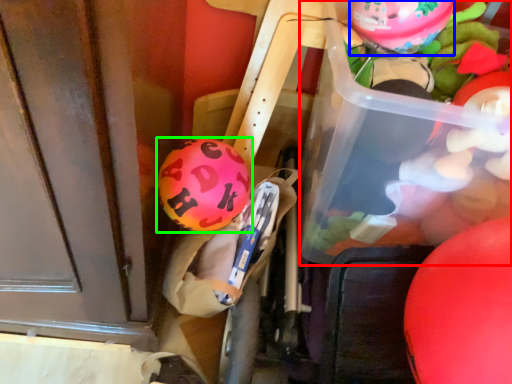
Question: Which object is the farthest from wide (highlighted by a red box)? Choose among these: balloon (highlighted by a blue box) or balloon (highlighted by a green box).

Choices:
 (A) balloon
 (B) balloon

Answer: (B)